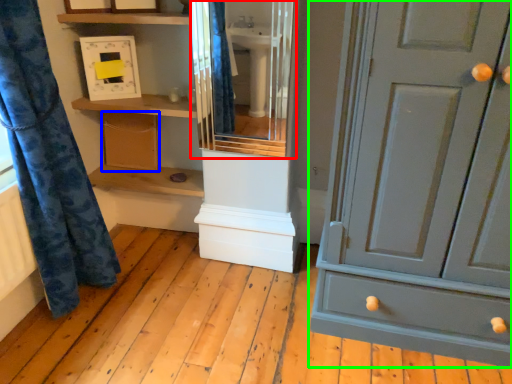
Question: Considering the real-world distances, which object is farthest from cabinet (highlighted by a red box)? cabinetry (highlighted by a blue box) or chest of drawers (highlighted by a green box)?

Choices:
 (A) cabinetry
 (B) chest of drawers

Answer: (B)